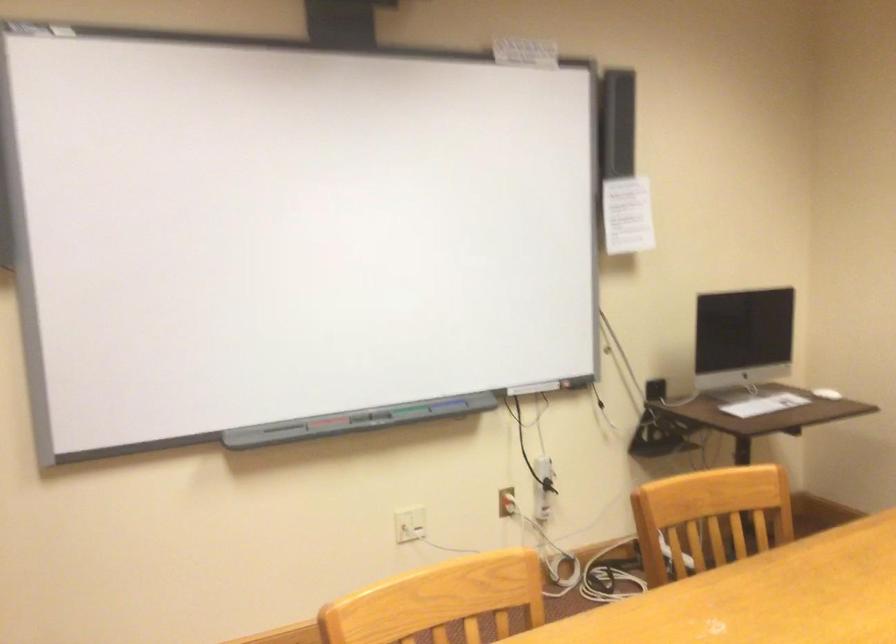
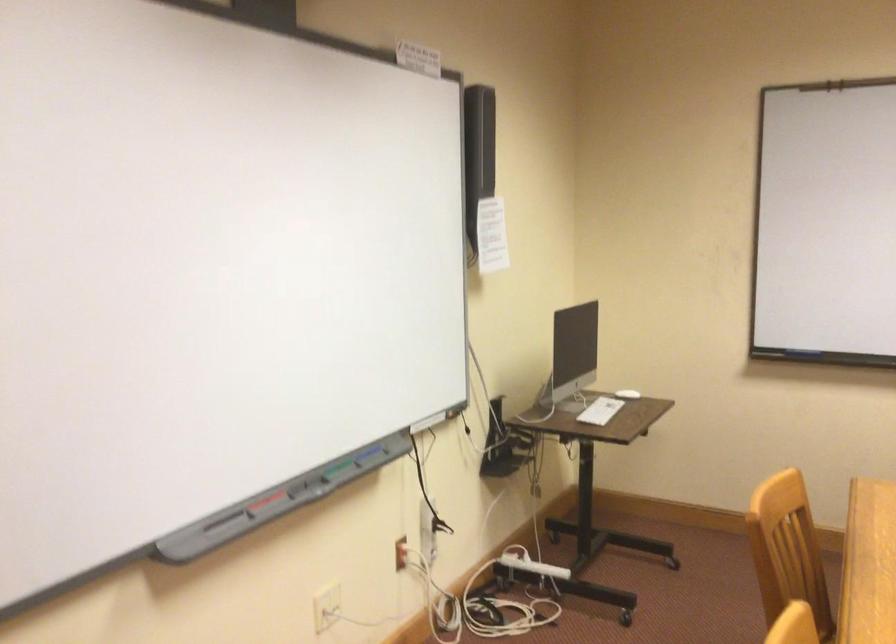
Locate, in the second image, the point that corresponds to the point at 756,404 in the first image.

(600, 410)